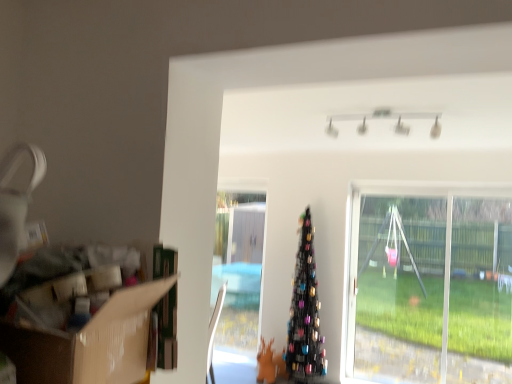
Question: From their relative heights in the image, would you say black metallic christmas tree at center is taller or shorter than cardboard box at left?

Choices:
 (A) short
 (B) tall

Answer: (B)

Question: From the image's perspective, is black metallic christmas tree at center above or below cardboard box at left?

Choices:
 (A) above
 (B) below

Answer: (B)

Question: Which of these objects is positioned closest to the transparent plastic swing at right?

Choices:
 (A) cardboard box at left
 (B) black metallic christmas tree at center

Answer: (B)

Question: Estimate the real-world distances between objects in this image. Which object is closer to the black metallic christmas tree at center?

Choices:
 (A) transparent plastic swing at right
 (B) cardboard box at left

Answer: (A)